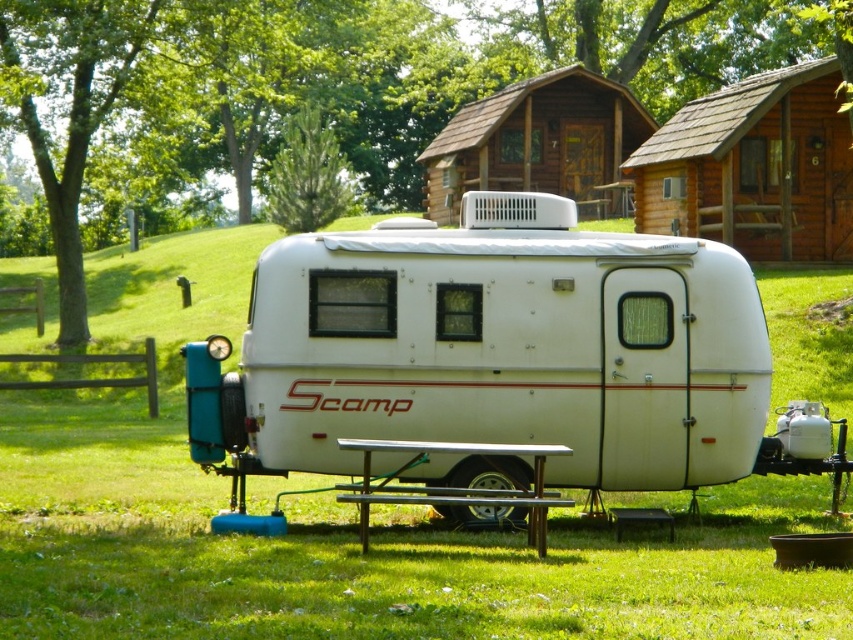
Looking at this image, is white matte recreational vehicle at center to the left of green leafy tree at upper center from the viewer's perspective?

No, white matte recreational vehicle at center is not to the left of green leafy tree at upper center.

Which is more to the left, white matte recreational vehicle at center or green leafy tree at upper center?

From the viewer's perspective, green leafy tree at upper center appears more on the left side.

Between point (219, 349) and point (322, 138), which one is positioned behind?

Point (322, 138)

The image size is (853, 640). Identify the location of white matte recreational vehicle at center. (489, 352).

Which is below, green leafy tree at center or green leafy tree at upper center?

green leafy tree at upper center is lower down.

Who is more forward, (660, 22) or (322, 140)?

Point (322, 140)

I want to click on green leafy tree at center, so click(317, 90).

Who is more forward, (817, 45) or (534, 536)?

Point (534, 536)

Measure the distance from green leafy tree at center to metallic silver picnic table at lower center.

They are 79.70 feet apart.

From the picture: Who is more distant from viewer, (50, 35) or (469, 456)?

The point (50, 35) is more distant.

Where is `green leafy tree at center`? Image resolution: width=853 pixels, height=640 pixels. green leafy tree at center is located at coordinates (317, 90).